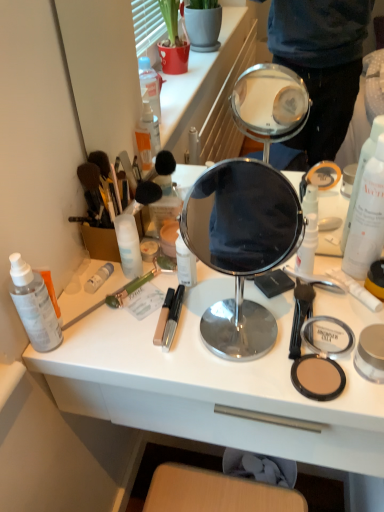
You are a GUI agent. You are given a task and a screenshot of the screen. Output one action in this format:
    pyautogui.click(x=<x>, y=<y>)
    Task: Click on the unoccupied space behind polished silver mirror at center
    This screenshot has height=512, width=384.
    Given the screenshot: What is the action you would take?
    pyautogui.click(x=220, y=284)